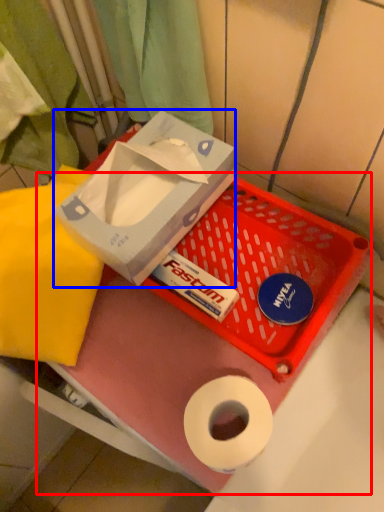
Question: Among these objects, which one is farthest to the camera, box (highlighted by a red box) or box (highlighted by a blue box)?

Choices:
 (A) box
 (B) box

Answer: (A)